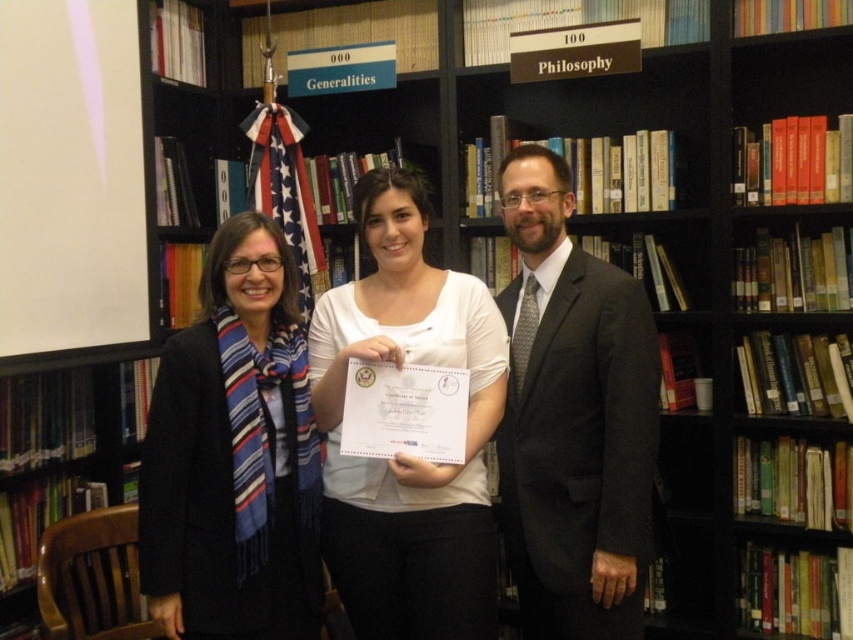
Does blue striped scarf at left appear on the right side of dark gray suit at center?

In fact, blue striped scarf at left is to the left of dark gray suit at center.

The image size is (853, 640). What do you see at coordinates (234, 456) in the screenshot? I see `blue striped scarf at left` at bounding box center [234, 456].

Locate an element on the screen. The height and width of the screenshot is (640, 853). blue striped scarf at left is located at coordinates (234, 456).

At what (x,y) coordinates should I click in order to perform the action: click on blue striped scarf at left. Please return your answer as a coordinate pair (x, y). Looking at the image, I should click on (234, 456).

Which is more to the left, dark gray suit at center or white matte certificate at center?

From the viewer's perspective, white matte certificate at center appears more on the left side.

Who is shorter, dark gray suit at center or white matte certificate at center?

white matte certificate at center

Which is behind, point (598, 353) or point (321, 374)?

The point (321, 374) is more distant.

This screenshot has width=853, height=640. In order to click on dark gray suit at center in this screenshot , I will do `click(573, 417)`.

How much distance is there between blue striped scarf at left and white matte certificate at center?

They are 8.71 inches apart.

Who is more distant from viewer, (265,556) or (473,433)?

The point (473,433) is more distant.

What do you see at coordinates (234, 456) in the screenshot?
I see `blue striped scarf at left` at bounding box center [234, 456].

This screenshot has width=853, height=640. I want to click on blue striped scarf at left, so click(x=234, y=456).